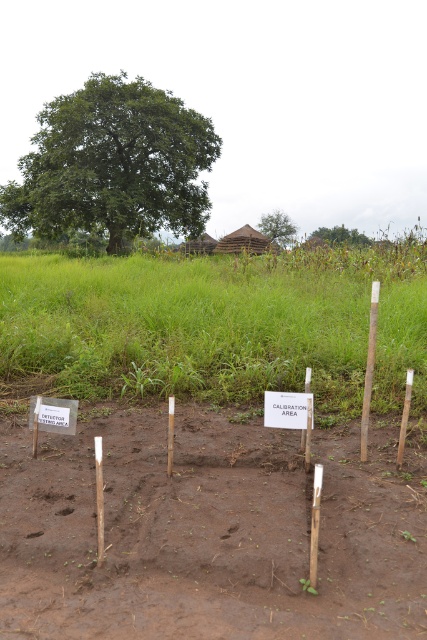
Which is in front, point (208, 424) or point (207, 148)?

Point (208, 424)

Is point (263, 429) positioned before point (58, 97)?

That is True.

Between point (260, 508) and point (143, 188), which one is positioned in front?

Point (260, 508) is more forward.

Image resolution: width=427 pixels, height=640 pixels. Find the location of `brown soil at center`. brown soil at center is located at coordinates (208, 531).

Is brown soil at center to the left of green leafy tree at center from the viewer's perspective?

Yes, brown soil at center is to the left of green leafy tree at center.

Is brown soil at center to the right of green leafy tree at center from the viewer's perspective?

Incorrect, brown soil at center is not on the right side of green leafy tree at center.

Where is `brown soil at center`? The width and height of the screenshot is (427, 640). brown soil at center is located at coordinates (208, 531).

Who is higher up, brown soil at center or white wood pole at right?

white wood pole at right is above.

Who is lower down, brown soil at center or white wood pole at right?

brown soil at center is lower down.

At what (x,y) coordinates should I click in order to perform the action: click on brown soil at center. Please return your answer as a coordinate pair (x, y). This screenshot has height=640, width=427. Looking at the image, I should click on 208,531.

Find the location of a particular element. The height and width of the screenshot is (640, 427). brown soil at center is located at coordinates (208, 531).